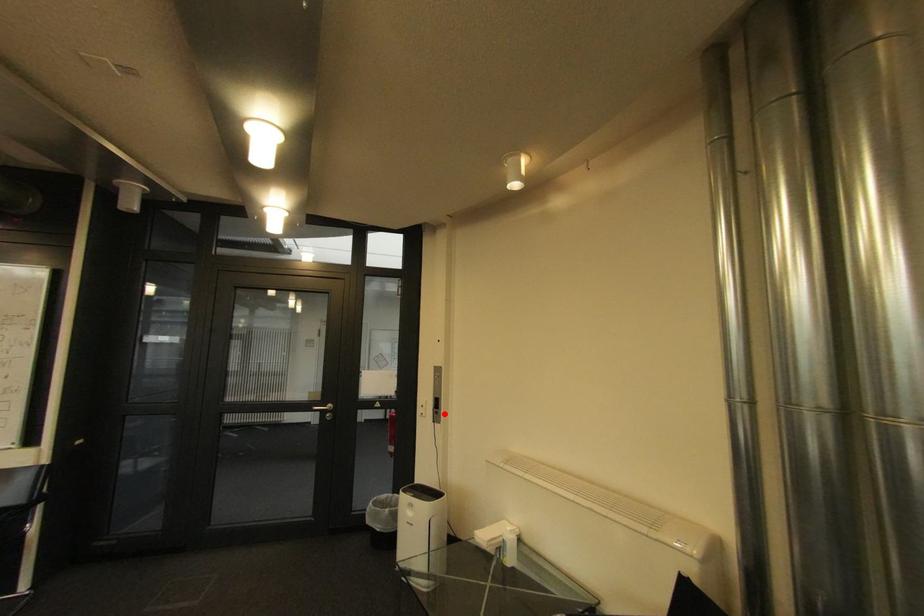
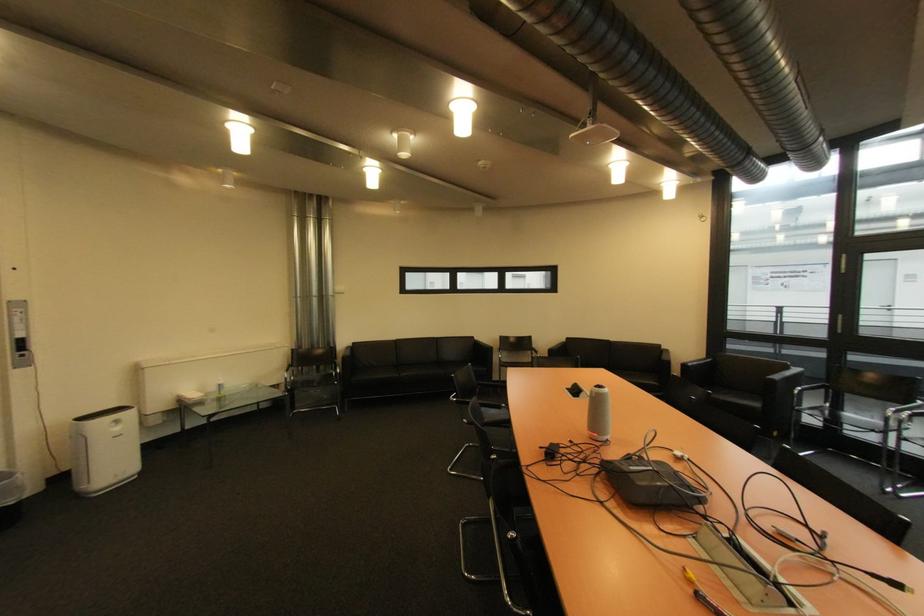
Where in the second image is the point corresponding to the highlighted location from the first image?

(30, 357)